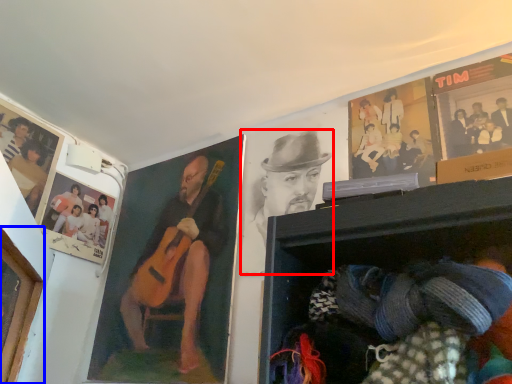
Question: Which point is further to the camera, man (highlighted by a red box) or portrait (highlighted by a blue box)?

Choices:
 (A) man
 (B) portrait

Answer: (A)